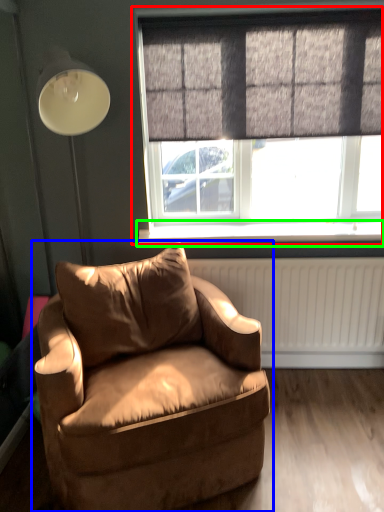
Question: Which object is positioned farthest from window (highlighted by a red box)? Select from chair (highlighted by a blue box) and window sill (highlighted by a green box).

Choices:
 (A) chair
 (B) window sill

Answer: (A)